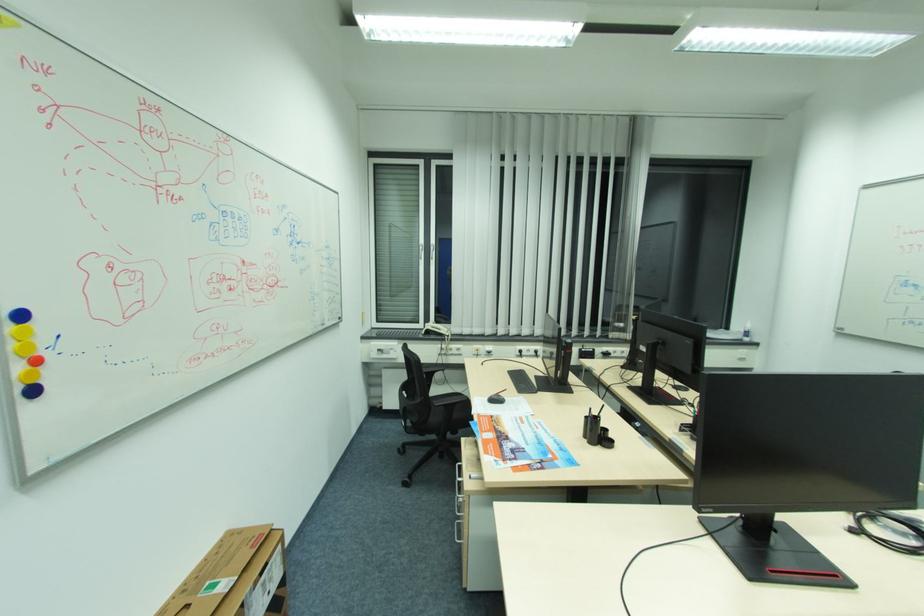
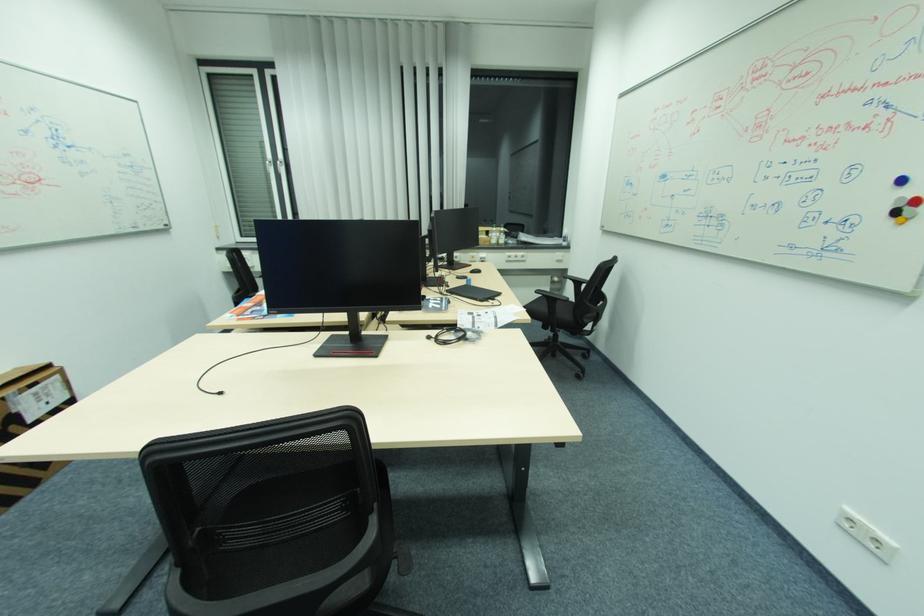
In the second image, find the point that corresponds to [859,531] in the first image.

(434, 338)